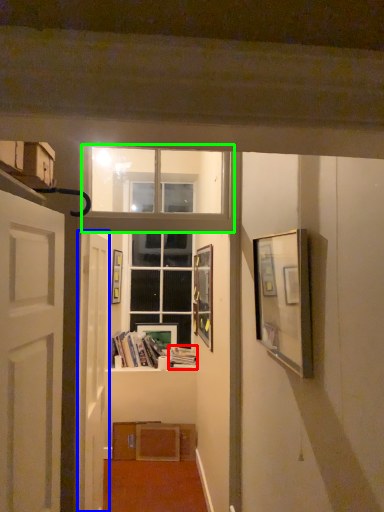
Question: Which is farther away from book (highlighted by a red box)? door (highlighted by a blue box) or window frame (highlighted by a green box)?

Choices:
 (A) door
 (B) window frame

Answer: (B)